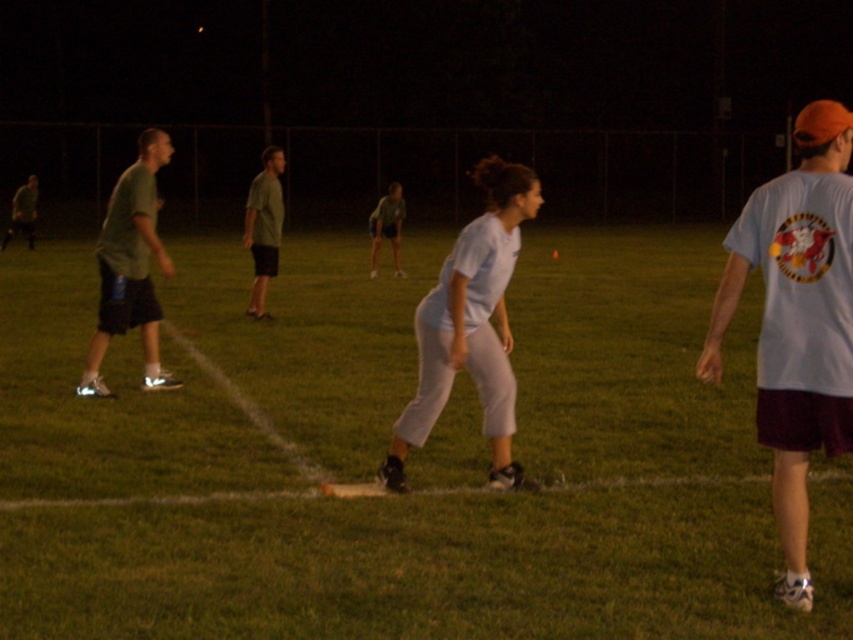
Looking at this image, you are a photographer trying to capture a photo of the nighttime kickball game. You need to ensure that both the green grass football field at center and the matte green shirt at left are visible in your shot. Which object should you focus on first to ensure proper depth of field?

The matte green shirt at left should be focused on first because it is taller than the green grass football field at center, allowing the photographer to adjust the depth of field starting from the taller object.

Based on the photo, you are standing in the middle of the field and want to throw a ball to a teammate. You see two points marked on the field at coordinates point (834, 412) and point (374, 248). Which point is closer to you?

Point (834, 412) is closer to the camera than point (374, 248), so you should aim for point (834, 412) since it is closer to your position in the middle of the field.